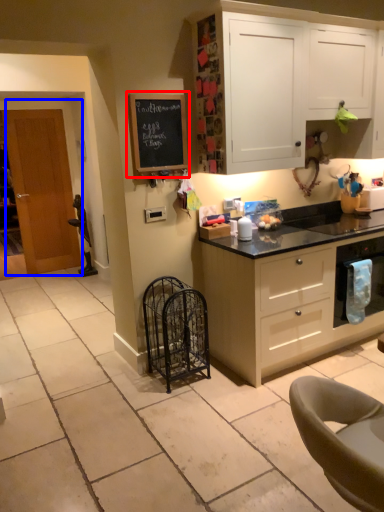
Question: Which object is further to the camera taking this photo, bulletin board (highlighted by a red box) or door (highlighted by a blue box)?

Choices:
 (A) bulletin board
 (B) door

Answer: (B)